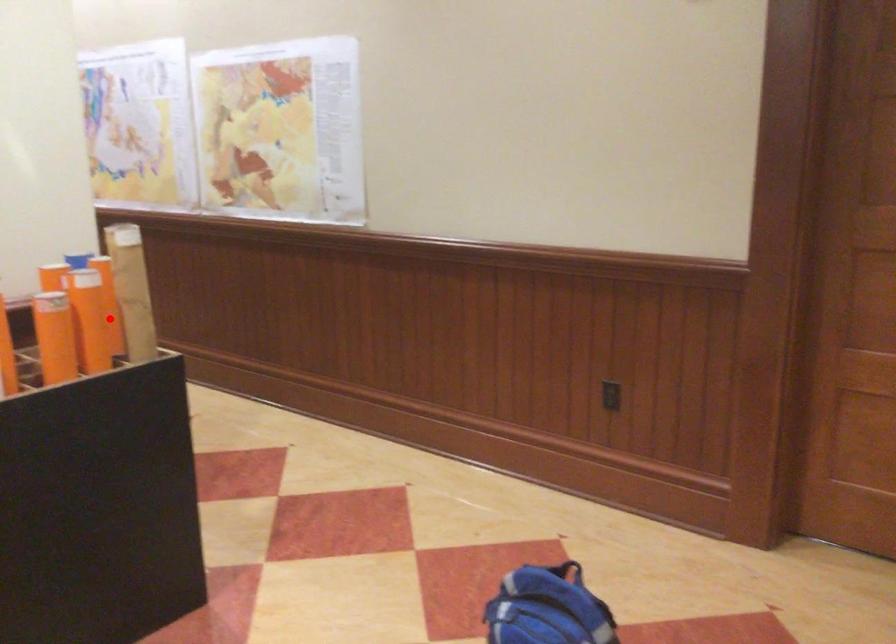
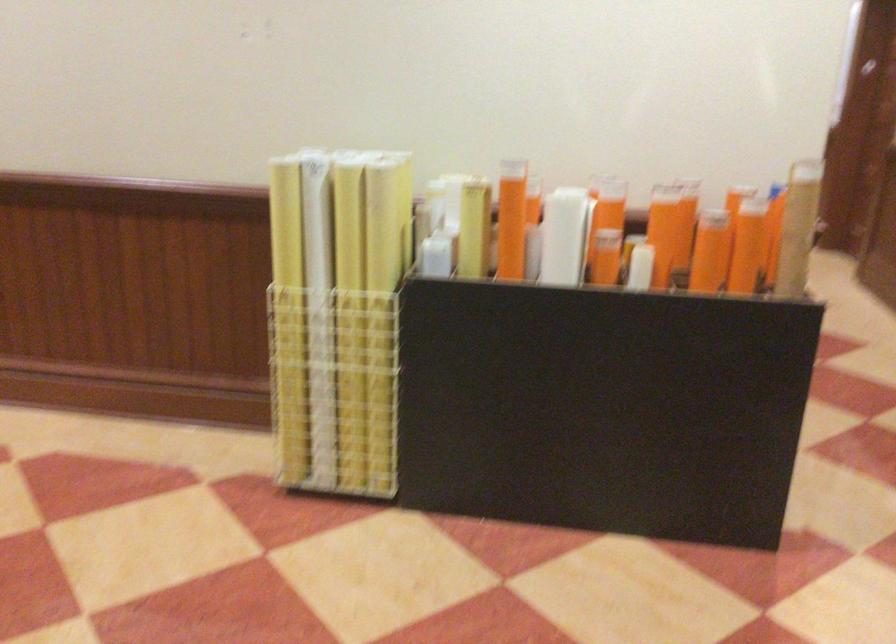
Find the pixel in the second image that matches the highlighted location in the first image.

(746, 245)